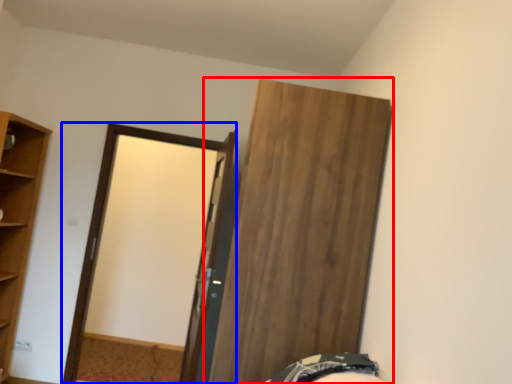
Question: Which of the following is the farthest to the observer, door (highlighted by a red box) or screen door (highlighted by a blue box)?

Choices:
 (A) door
 (B) screen door

Answer: (B)